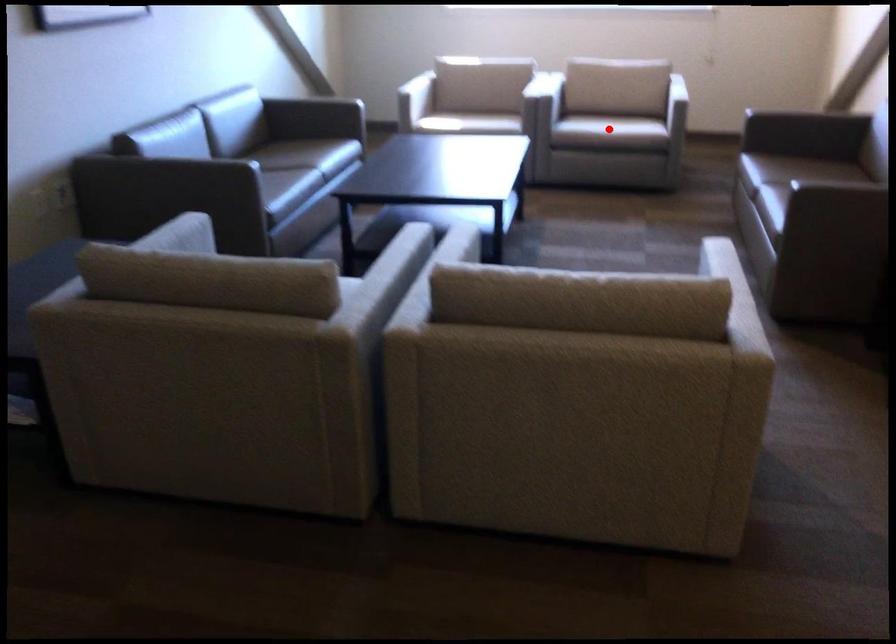
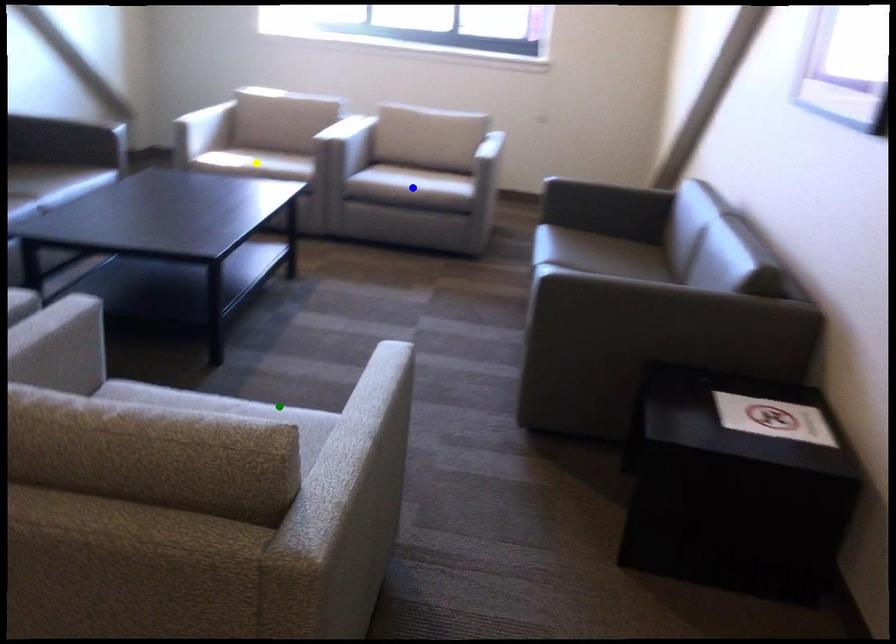
Question: I am providing you with two images of the same scene from different viewpoints. A red point is marked on the first image. You are given multiple points on the second image. Can you choose the point in image 2 that corresponds to the point in image 1?

Choices:
 (A) green point
 (B) yellow point
 (C) blue point

Answer: (C)